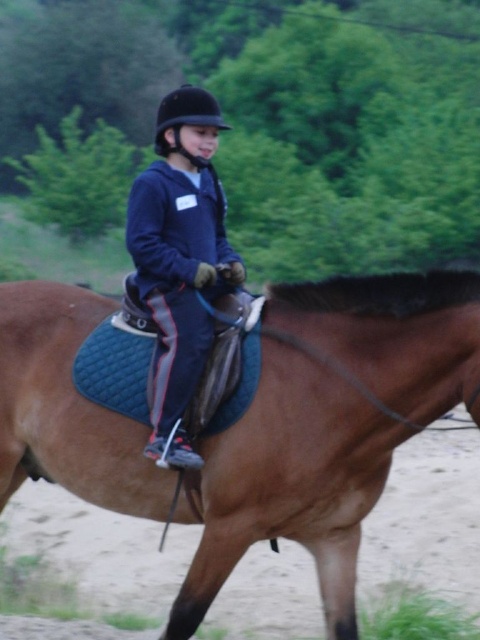
You are a horseback riding instructor observing a rider and their horse. You notice the brown leather saddle at center and the dark blue fleece jacket at center. Which object appears lower in height?

The brown leather saddle at center has a lesser height compared to the dark blue fleece jacket at center, so the saddle appears lower in height.